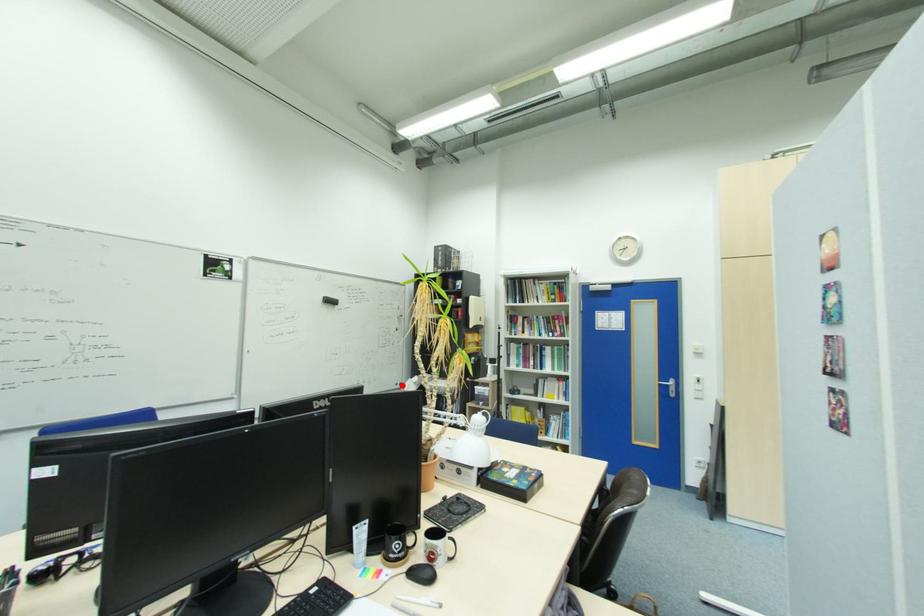
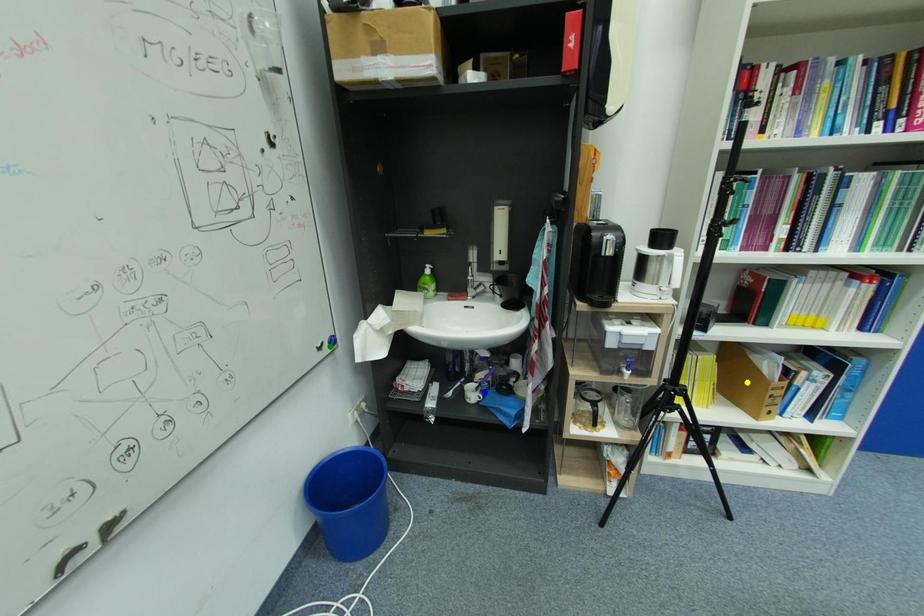
Question: I am providing you with two images of the same scene from different viewpoints. A red point is marked on the first image. You are given multiple points on the second image. Can you choose the point in image 2 that corresponds to the point in image 1?

Choices:
 (A) green point
 (B) yellow point
 (C) blue point

Answer: (A)